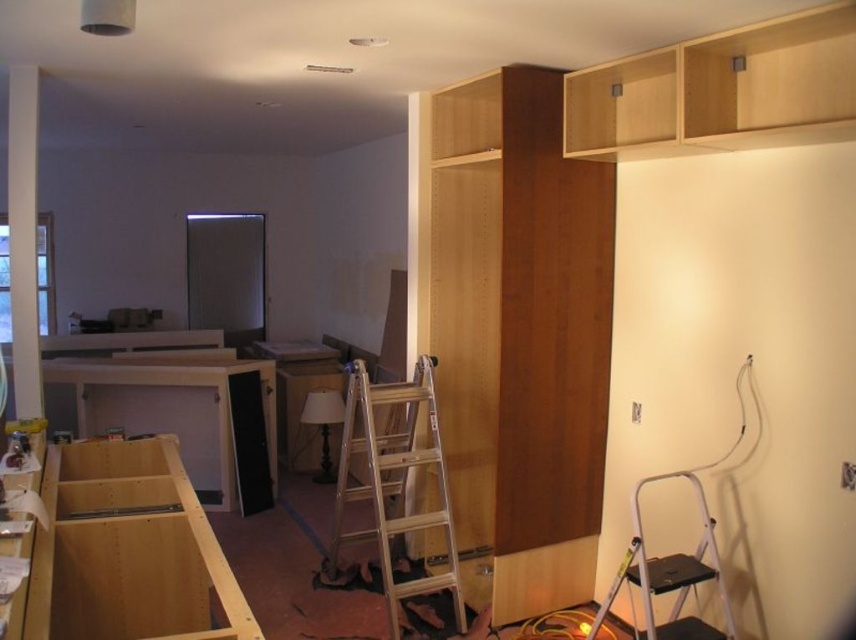
You are a construction worker who needs to reach the top of the wooden cabinets. Which ladder should you use, the wooden ladder at center or the metallic silver step ladder at lower right?

The wooden ladder at center is above the metallic silver step ladder at lower right, so you should use the wooden ladder at center to reach the top of the wooden cabinets.